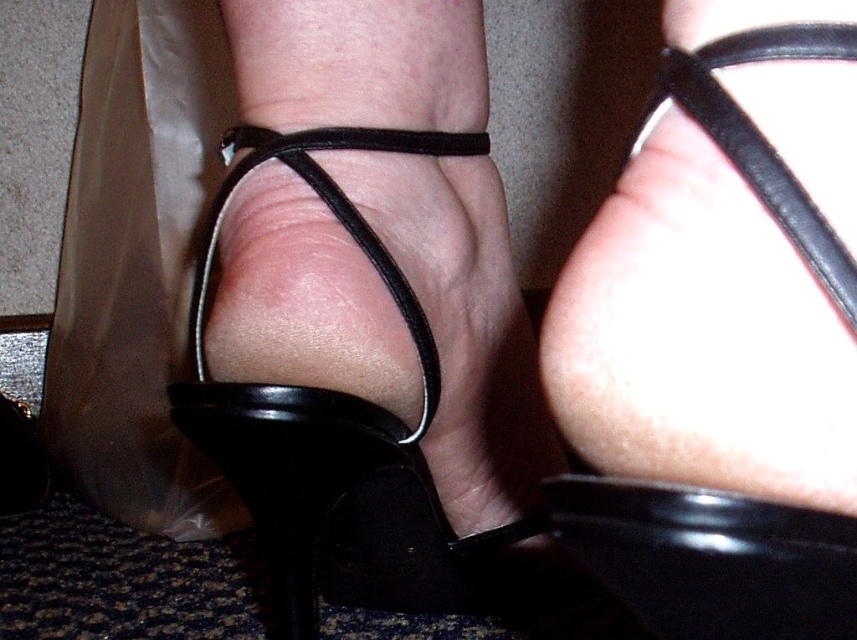
Looking at this image, between black suede sandal at center and black leather sandal at center, which one has less height?

Standing shorter between the two is black leather sandal at center.

Does black suede sandal at center appear on the right side of black leather sandal at center?

No, black suede sandal at center is not to the right of black leather sandal at center.

Between point (262, 522) and point (754, 566), which one is positioned in front?

Point (754, 566) is in front.

Identify the location of black suede sandal at center. Image resolution: width=857 pixels, height=640 pixels. (346, 440).

Between black leather sandal at center and black leather strap at upper right, which one appears on the right side from the viewer's perspective?

From the viewer's perspective, black leather strap at upper right appears more on the right side.

Who is lower down, black leather sandal at center or black leather strap at upper right?

black leather sandal at center is lower down.

What do you see at coordinates (710, 560) in the screenshot? Image resolution: width=857 pixels, height=640 pixels. I see `black leather sandal at center` at bounding box center [710, 560].

Locate an element on the screen. The height and width of the screenshot is (640, 857). black leather sandal at center is located at coordinates (710, 560).

Does point (396, 509) lie behind point (664, 104)?

Yes.

Which is more to the right, black suede sandal at center or black leather strap at upper right?

black leather strap at upper right is more to the right.

The width and height of the screenshot is (857, 640). Describe the element at coordinates (346, 440) in the screenshot. I see `black suede sandal at center` at that location.

Locate an element on the screen. black suede sandal at center is located at coordinates (346, 440).